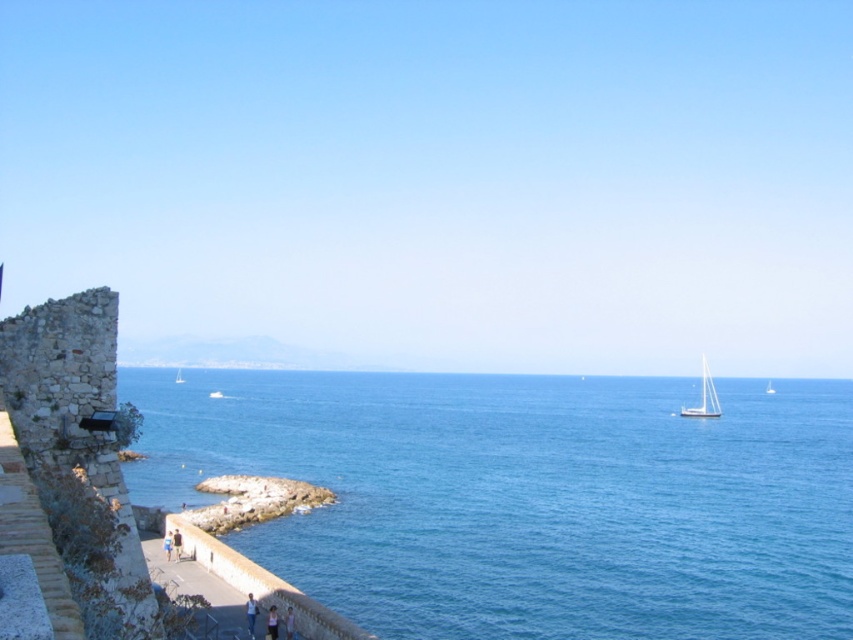
From the picture: You are a photographer standing at the stone wall in the foreground. You want to take a photo that includes both the white glossy sailboat at right and the blue fabric person at lower center. Which object should you zoom in on to ensure both are clearly visible in the frame?

You should zoom in on the blue fabric person at lower center because the white glossy sailboat at right is larger in size than the blue fabric person at lower center, so focusing on the smaller object will help balance both in the frame.

You are a drone operator tasked with capturing aerial footage of the coastal scene. Your drone has a maximum flight range of 150 meters. You need to fly from the blue water at lower left to the light pink fabric at lower center. Can your drone complete this flight without exceeding its range?

The distance between the blue water at lower left and the light pink fabric at lower center is 144.42 meters, which is within the drone operator drone maximum flight range of 150 meters. The drone can complete the flight without exceeding its range.

You are standing on the pathway and want to compare the heights of the blue water at lower left and the light pink fabric at lower center. Which one appears taller from your vantage point?

The blue water at lower left is taller than the light pink fabric at lower center according to the description.